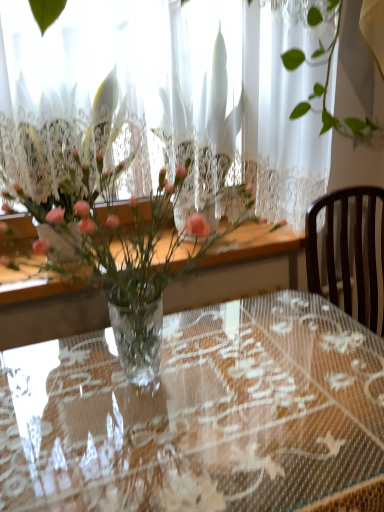
Find the location of a particular element. transparent lace tablecloth at center is located at coordinates (199, 414).

The image size is (384, 512). Describe the element at coordinates (199, 414) in the screenshot. I see `transparent lace tablecloth at center` at that location.

What are the coordinates of `translucent glass vase at center` in the screenshot? It's located at (146, 263).

Describe the element at coordinates (146, 263) in the screenshot. I see `translucent glass vase at center` at that location.

At what (x,y) coordinates should I click in order to perform the action: click on transparent lace tablecloth at center. Please return your answer as a coordinate pair (x, y). Looking at the image, I should click on (199, 414).

Consider the image. Would you say transparent lace tablecloth at center is to the left or to the right of translucent glass vase at center in the picture?

Based on their positions, transparent lace tablecloth at center is located to the right of translucent glass vase at center.

Between transparent lace tablecloth at center and translucent glass vase at center, which one is positioned in front?

Positioned in front is transparent lace tablecloth at center.

Which is behind, point (18, 360) or point (140, 281)?

Point (18, 360)

From the image's perspective, between transparent lace tablecloth at center and translucent glass vase at center, which one is located above?

translucent glass vase at center appears higher in the image.

From a real-world perspective, which object stands above the other?

translucent glass vase at center.

Looking at this image, between transparent lace tablecloth at center and translucent glass vase at center, which one has larger width?

transparent lace tablecloth at center.

Does transparent lace tablecloth at center have a greater height compared to translucent glass vase at center?

Yes.

Considering the sizes of transparent lace tablecloth at center and translucent glass vase at center in the image, is transparent lace tablecloth at center bigger or smaller than translucent glass vase at center?

transparent lace tablecloth at center is bigger than translucent glass vase at center.

Would you say transparent lace tablecloth at center contains translucent glass vase at center?

That's incorrect, translucent glass vase at center is not inside transparent lace tablecloth at center.

Is transparent lace tablecloth at center beside translucent glass vase at center?

No, transparent lace tablecloth at center is not in contact with translucent glass vase at center.

In the scene shown: Is transparent lace tablecloth at center positioned with its back to translucent glass vase at center?

That's not correct — transparent lace tablecloth at center is not looking away from translucent glass vase at center.

What's the angular difference between transparent lace tablecloth at center and translucent glass vase at center's facing directions?

There is a 0.839-degree angle between the facing directions of transparent lace tablecloth at center and translucent glass vase at center.

At what (x,y) coordinates should I click in order to perform the action: click on bouquet behind the transparent lace tablecloth at center. Please return your answer as a coordinate pair (x, y). Image resolution: width=384 pixels, height=512 pixels. Looking at the image, I should click on (146, 263).

Is translucent glass vase at center at the right side of transparent lace tablecloth at center?

No.

Considering their positions, is translucent glass vase at center located in front of or behind transparent lace tablecloth at center?

translucent glass vase at center is behind transparent lace tablecloth at center.

Does point (102, 263) appear closer or farther from the camera than point (34, 486)?

Point (102, 263) is farther from the camera than point (34, 486).

From the image's perspective, is translucent glass vase at center positioned above or below transparent lace tablecloth at center?

From the image's perspective, translucent glass vase at center appears above transparent lace tablecloth at center.

From a real-world perspective, is translucent glass vase at center above or below transparent lace tablecloth at center?

Clearly, from a real-world perspective, translucent glass vase at center is above transparent lace tablecloth at center.

Considering the relative sizes of translucent glass vase at center and transparent lace tablecloth at center in the image provided, is translucent glass vase at center wider than transparent lace tablecloth at center?

No.

Considering the relative sizes of translucent glass vase at center and transparent lace tablecloth at center in the image provided, is translucent glass vase at center taller than transparent lace tablecloth at center?

No.

Based on their sizes in the image, would you say translucent glass vase at center is bigger or smaller than transparent lace tablecloth at center?

Clearly, translucent glass vase at center is smaller in size than transparent lace tablecloth at center.

Which is correct: translucent glass vase at center is inside transparent lace tablecloth at center, or outside of it?

translucent glass vase at center is not enclosed by transparent lace tablecloth at center.

Would you say translucent glass vase at center is a long distance from transparent lace tablecloth at center?

That's not correct — translucent glass vase at center is a little close to transparent lace tablecloth at center.

Is translucent glass vase at center positioned with its back to transparent lace tablecloth at center?

No, transparent lace tablecloth at center is not at the back of translucent glass vase at center.

How different are the orientations of translucent glass vase at center and transparent lace tablecloth at center in degrees?

0.839 degrees.

The height and width of the screenshot is (512, 384). What are the coordinates of `bouquet on the left side of transparent lace tablecloth at center` in the screenshot? It's located at (146, 263).

Locate an element on the screen. Image resolution: width=384 pixels, height=512 pixels. bouquet on the left side of transparent lace tablecloth at center is located at coordinates (146, 263).

The width and height of the screenshot is (384, 512). I want to click on table below the translucent glass vase at center (from the image's perspective), so click(x=199, y=414).